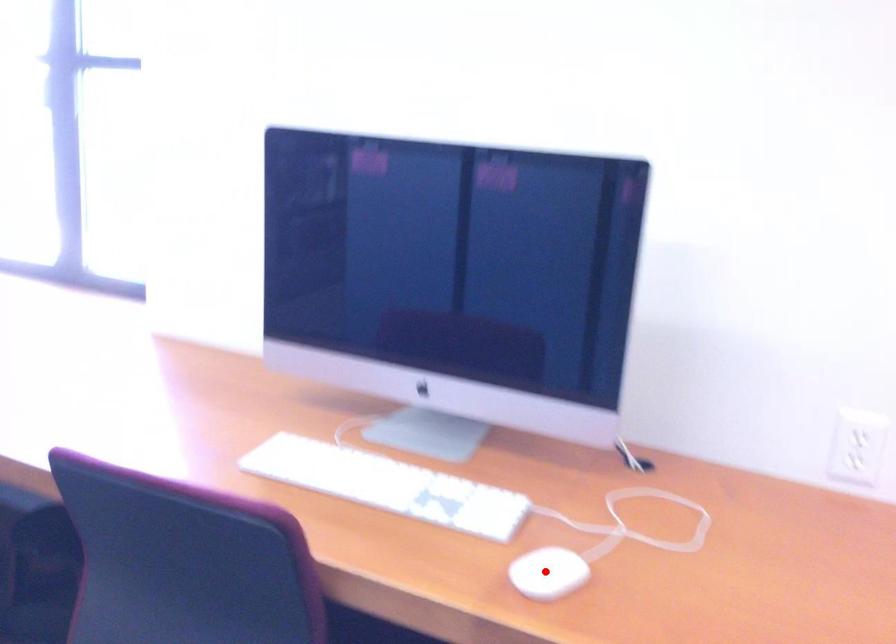
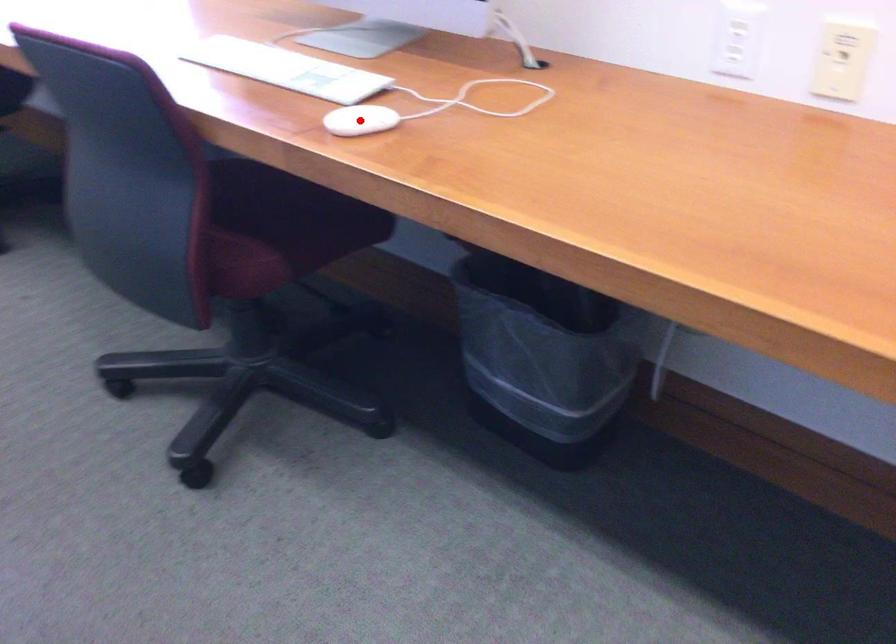
I am providing you with two images of the same scene from different viewpoints. A red point is marked on the first image and another point is marked on the second image. Is the marked point in image1 the same physical position as the marked point in image2?

Yes